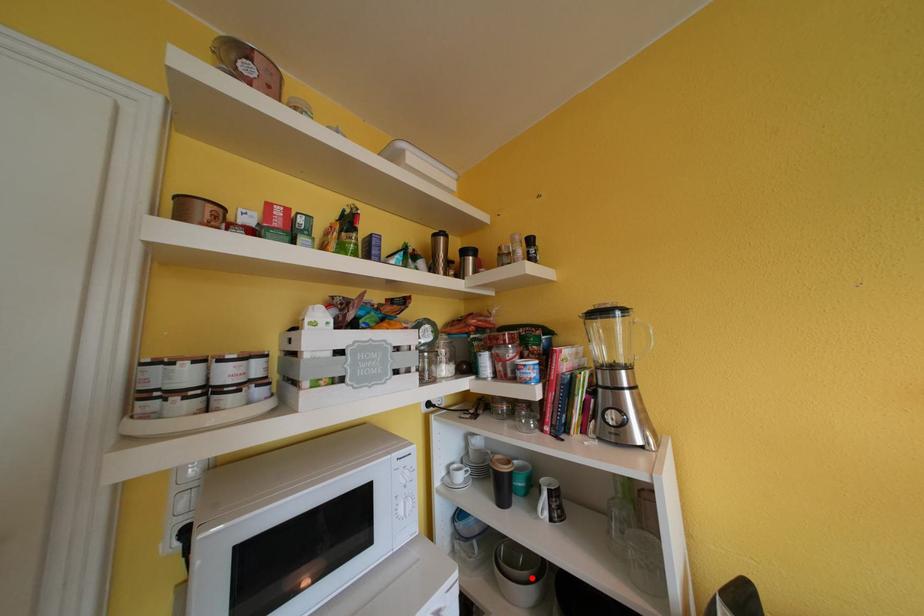
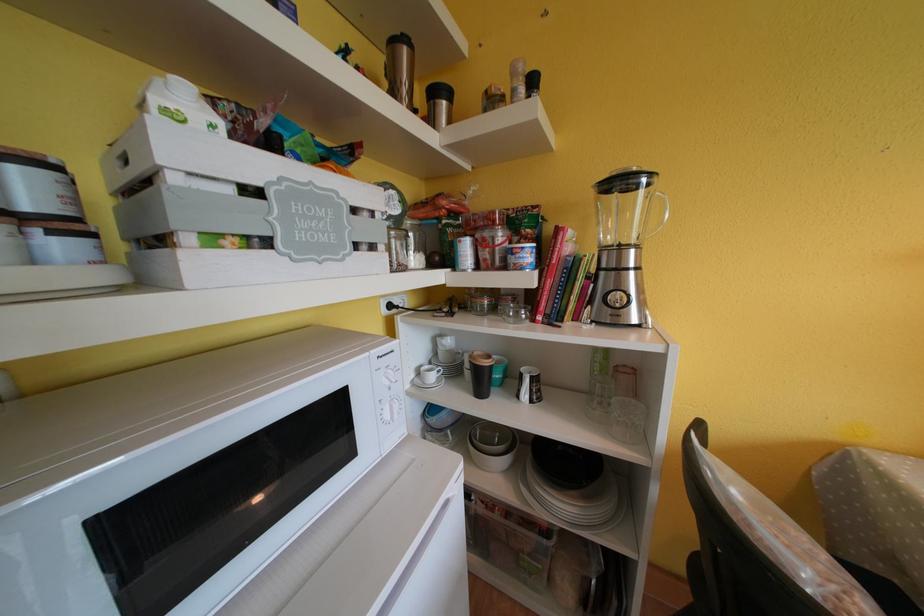
Question: I am providing you with two images of the same scene from different viewpoints. In image1, a red point is highlighted. Considering the same 3D point in image2, which of the following is correct?

Choices:
 (A) It is closer
 (B) It is farther

Answer: (B)